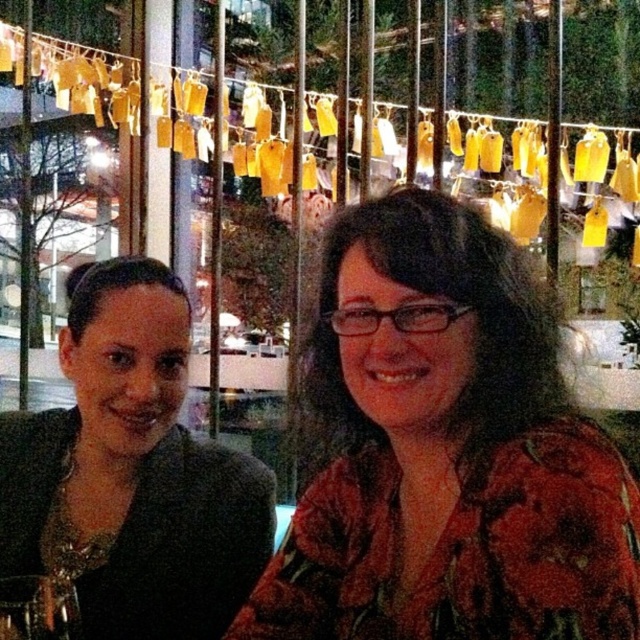
Is matte black top at left bigger than transparent glass wine glass at lower left?

Yes, matte black top at left is bigger than transparent glass wine glass at lower left.

Is matte black top at left wider than transparent glass wine glass at lower left?

Correct, the width of matte black top at left exceeds that of transparent glass wine glass at lower left.

At what (x,y) coordinates should I click in order to perform the action: click on matte black top at left. Please return your answer as a coordinate pair (x, y). The image size is (640, 640). Looking at the image, I should click on (131, 472).

Can you confirm if floral-patterned shirt at center is wider than transparent glass wine glass at lower left?

Correct, the width of floral-patterned shirt at center exceeds that of transparent glass wine glass at lower left.

Which is more to the left, floral-patterned shirt at center or transparent glass wine glass at lower left?

transparent glass wine glass at lower left is more to the left.

What are the coordinates of `floral-patterned shirt at center` in the screenshot? It's located at (445, 451).

Can you confirm if floral-patterned shirt at center is taller than matte black top at left?

No.

Between floral-patterned shirt at center and matte black top at left, which one has more height?

matte black top at left is taller.

Is point (362, 236) positioned before point (148, 531)?

Yes.

Image resolution: width=640 pixels, height=640 pixels. Identify the location of floral-patterned shirt at center. (445, 451).